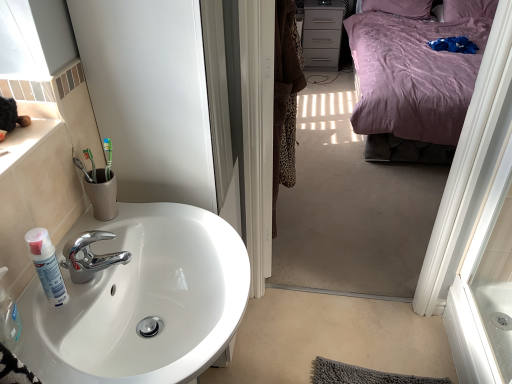
Question: From the image's perspective, is white glossy sink at lower left located above or below matte gray cabinet at upper right?

Choices:
 (A) below
 (B) above

Answer: (A)

Question: Considering the positions of white glossy sink at lower left and matte gray cabinet at upper right in the image, is white glossy sink at lower left taller or shorter than matte gray cabinet at upper right?

Choices:
 (A) tall
 (B) short

Answer: (A)

Question: Which object is positioned farthest from the purple satin pillow at upper right?

Choices:
 (A) white glossy sink at lower left
 (B) purple satin bed at upper right
 (C) green toothbrush at sink
 (D) white matte spray can at sink left
 (E) matte gray cabinet at upper right

Answer: (D)

Question: Which object is positioned farthest from the purple satin pillow at upper right?

Choices:
 (A) white glossy sink at lower left
 (B) matte gray cabinet at upper right
 (C) green toothbrush at sink
 (D) purple satin bed at upper right
 (E) white matte spray can at sink left

Answer: (E)